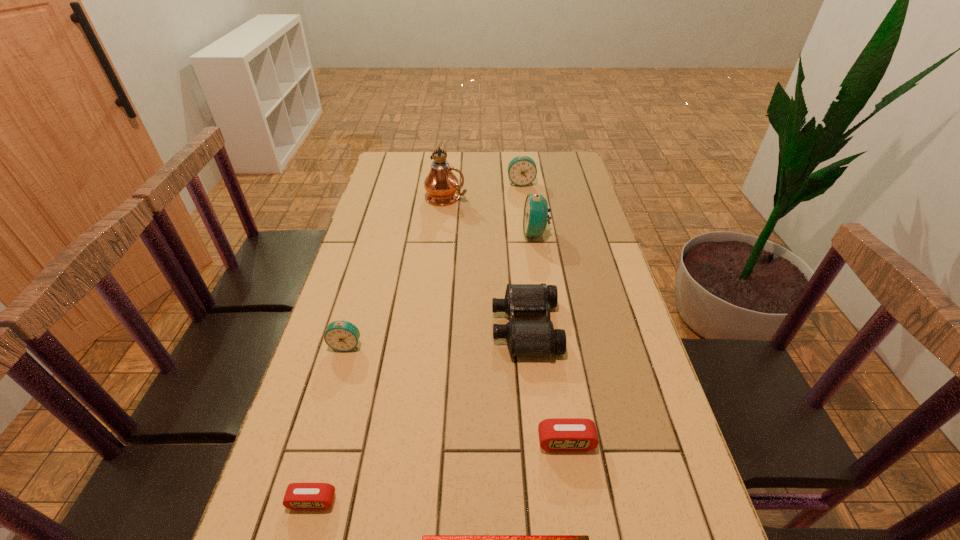
In order to click on the third shortest object in this screenshot , I will do `click(557, 434)`.

This screenshot has height=540, width=960. What are the coordinates of `the nearer pink alarm clock` in the screenshot? It's located at (299, 496).

This screenshot has width=960, height=540. Find the location of `the second nearest object`. the second nearest object is located at coordinates (299, 496).

Where is `vacant position located 0.100m on the right of the tallest object`? The height and width of the screenshot is (540, 960). vacant position located 0.100m on the right of the tallest object is located at coordinates (494, 197).

What are the coordinates of `vacant position located 0.170m on the front-facing side of the second farthest blue alarm clock` in the screenshot? It's located at (472, 233).

The image size is (960, 540). In order to click on free space located on the front-facing side of the second farthest blue alarm clock in this screenshot , I will do `click(440, 233)`.

Identify the location of free space located 0.080m on the front-facing side of the second farthest blue alarm clock. The width and height of the screenshot is (960, 540). (499, 233).

Locate an element on the screen. The image size is (960, 540). vacant space located 0.080m on the front-facing side of the third tallest object is located at coordinates (523, 199).

Identify the location of vacant space situated on the front-facing side of the smallest blue alarm clock. (301, 503).

You are a GUI agent. You are given a task and a screenshot of the screen. Output one action in this format:
    pyautogui.click(x=<x>, y=<y>)
    Task: Click on the free space located through the eyepieces of the binoculars
    This screenshot has height=540, width=960.
    Given the screenshot: What is the action you would take?
    pyautogui.click(x=436, y=327)